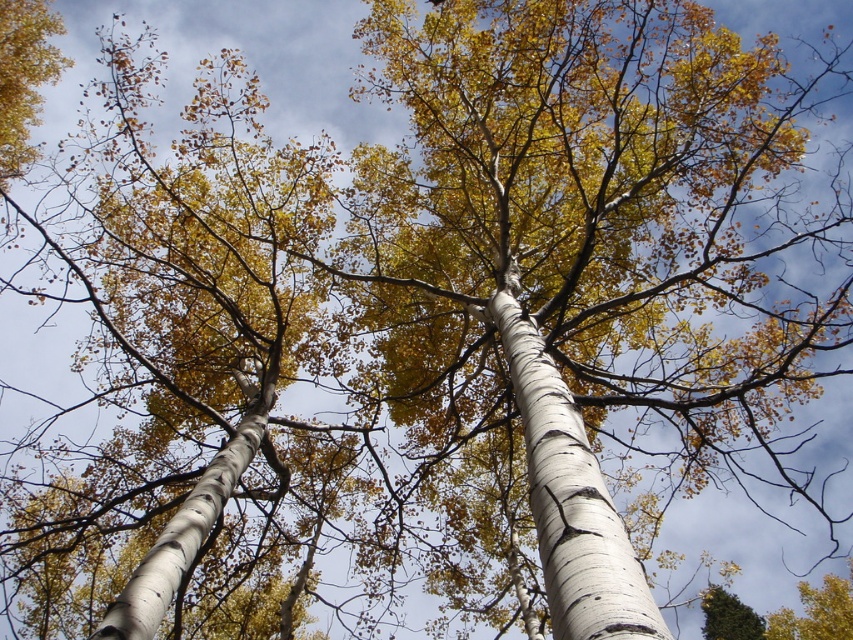
Question: Does white bark birch tree at center have a larger size compared to white bark tree at center?

Choices:
 (A) yes
 (B) no

Answer: (B)

Question: Is white bark birch tree at center to the left of white bark tree at center from the viewer's perspective?

Choices:
 (A) yes
 (B) no

Answer: (B)

Question: Among these objects, which one is nearest to the camera?

Choices:
 (A) white bark tree at center
 (B) white bark birch tree at center

Answer: (B)

Question: From the image, what is the correct spatial relationship of white bark birch tree at center in relation to white bark tree at center?

Choices:
 (A) above
 (B) below

Answer: (A)